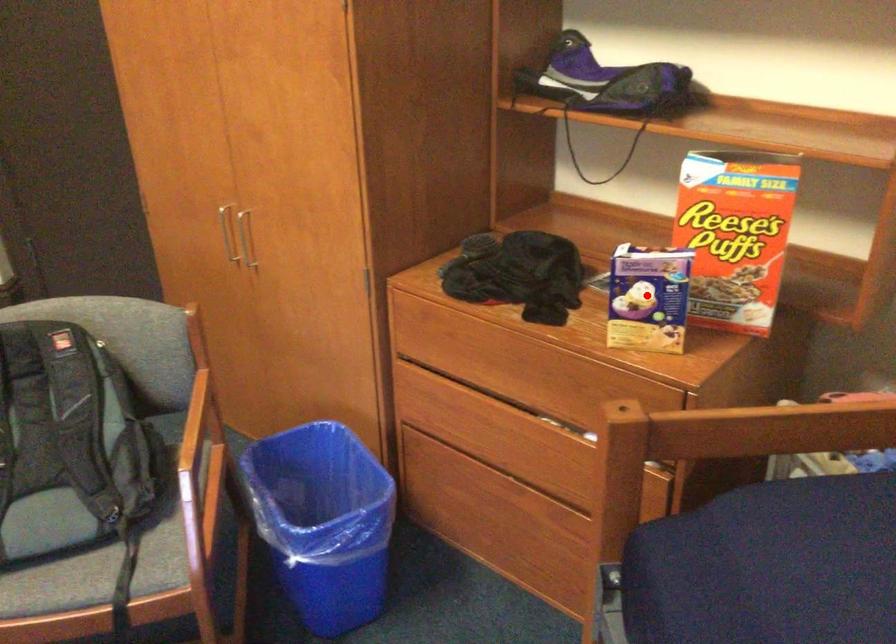
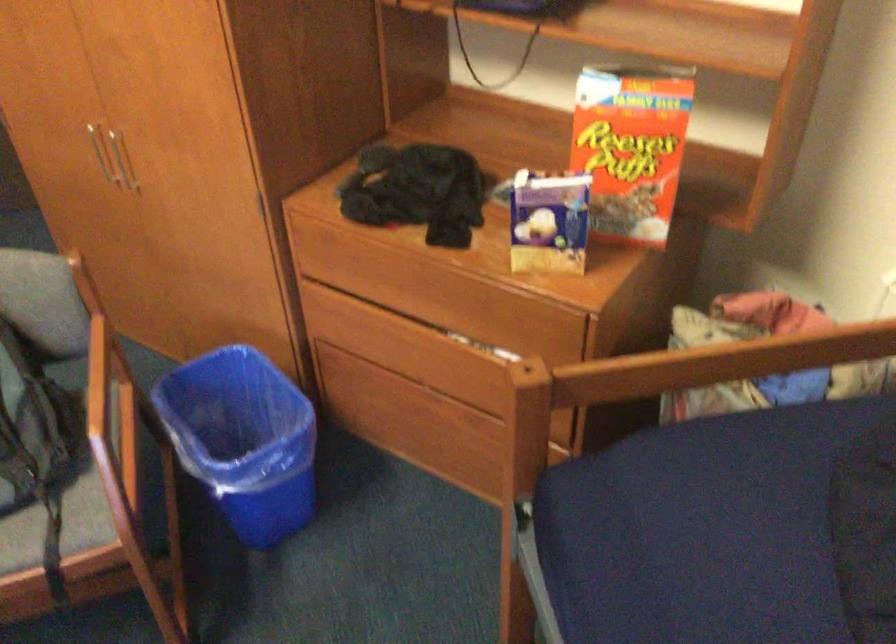
In the second image, find the point that corresponds to the highlighted location in the first image.

(548, 223)